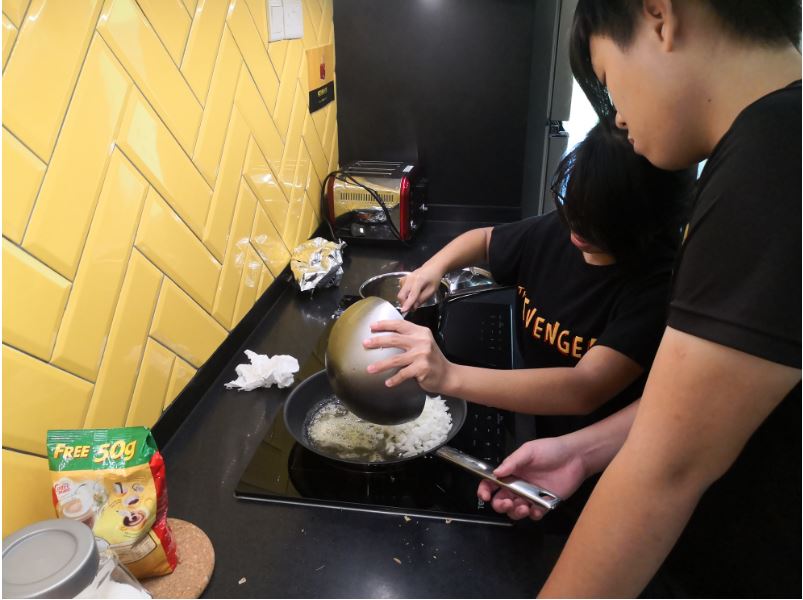
This screenshot has width=803, height=600. I want to click on countertop, so click(367, 554).